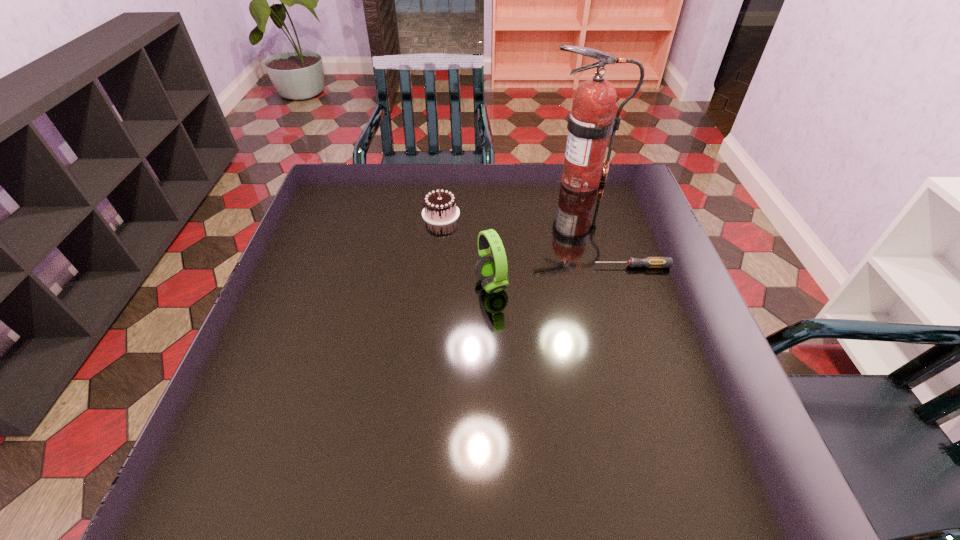
Locate an element on the screen. fire extinguisher is located at coordinates (591, 121).

In order to click on the tallest object in this screenshot , I will do `click(591, 121)`.

The width and height of the screenshot is (960, 540). Identify the location of headset. [492, 270].

The image size is (960, 540). Find the location of `the third shortest object`. the third shortest object is located at coordinates (492, 270).

Where is `the third nearest object`? This screenshot has width=960, height=540. the third nearest object is located at coordinates (440, 208).

This screenshot has width=960, height=540. What are the coordinates of `chocolate cake` in the screenshot? It's located at (440, 208).

Find the location of a particular element. The height and width of the screenshot is (540, 960). the shortest object is located at coordinates (651, 262).

Locate an element on the screen. Image resolution: width=960 pixels, height=540 pixels. vacant space located 0.060m at the nozzle of the tallest object is located at coordinates (524, 182).

Locate an element on the screen. The height and width of the screenshot is (540, 960). vacant area situated at the nozzle of the tallest object is located at coordinates (464, 182).

At what (x,y) coordinates should I click in order to perform the action: click on free space located at the nozzle of the tallest object. Please return your answer as a coordinate pair (x, y). The height and width of the screenshot is (540, 960). Looking at the image, I should click on (425, 182).